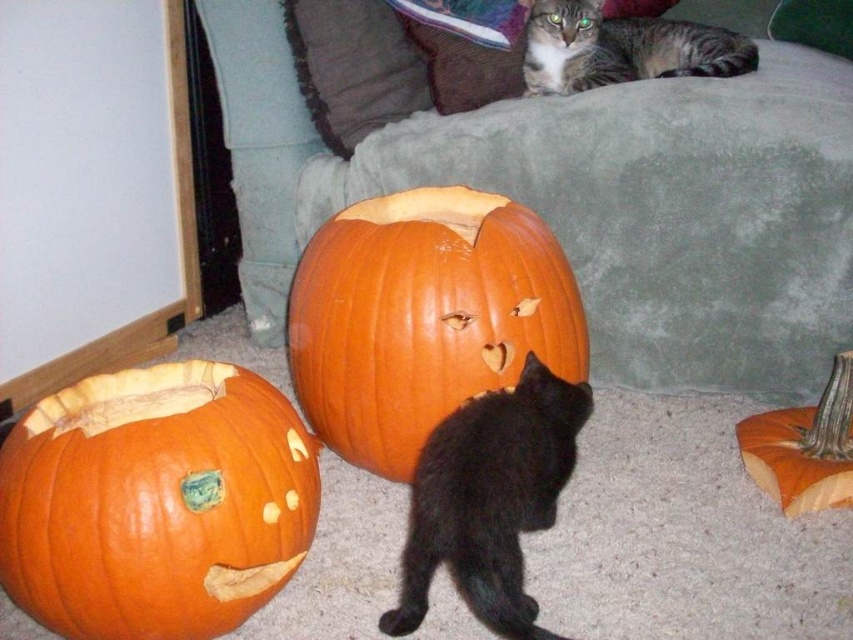
Who is shorter, orange matte pumpkin at center or black matte/black fur cat at lower center?

black matte/black fur cat at lower center is shorter.

Is orange matte pumpkin at center to the right of black matte/black fur cat at lower center from the viewer's perspective?

In fact, orange matte pumpkin at center is to the left of black matte/black fur cat at lower center.

Identify the location of orange matte pumpkin at center. This screenshot has width=853, height=640. (424, 316).

Who is taller, orange matte pumpkin at lower left or tabby fur cat at upper center?

Standing taller between the two is orange matte pumpkin at lower left.

In the scene shown: Who is positioned more to the left, orange matte pumpkin at lower left or tabby fur cat at upper center?

Positioned to the left is orange matte pumpkin at lower left.

Is point (157, 396) farther from viewer compared to point (575, 67)?

No, (157, 396) is in front of (575, 67).

Where is `orange matte pumpkin at lower left`? This screenshot has width=853, height=640. orange matte pumpkin at lower left is located at coordinates (155, 502).

Who is shorter, orange matte pumpkin at lower left or orange matte pumpkin at center?

orange matte pumpkin at lower left is shorter.

Is point (126, 516) more distant than point (422, 227)?

No, (126, 516) is closer to viewer.

This screenshot has width=853, height=640. Describe the element at coordinates (155, 502) in the screenshot. I see `orange matte pumpkin at lower left` at that location.

At what (x,y) coordinates should I click in order to perform the action: click on orange matte pumpkin at lower left. Please return your answer as a coordinate pair (x, y). Looking at the image, I should click on (155, 502).